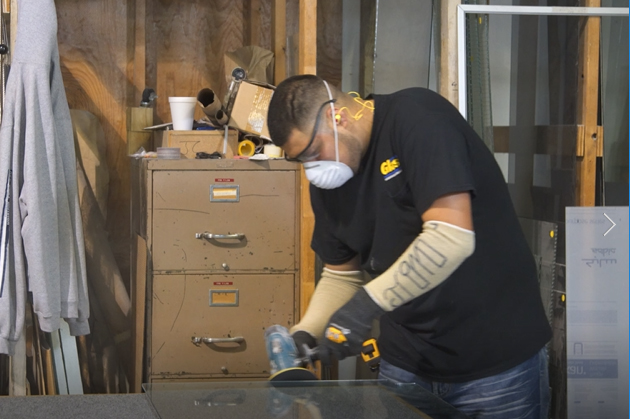
Find the location of a particular element. The height and width of the screenshot is (419, 630). table is located at coordinates (112, 406).